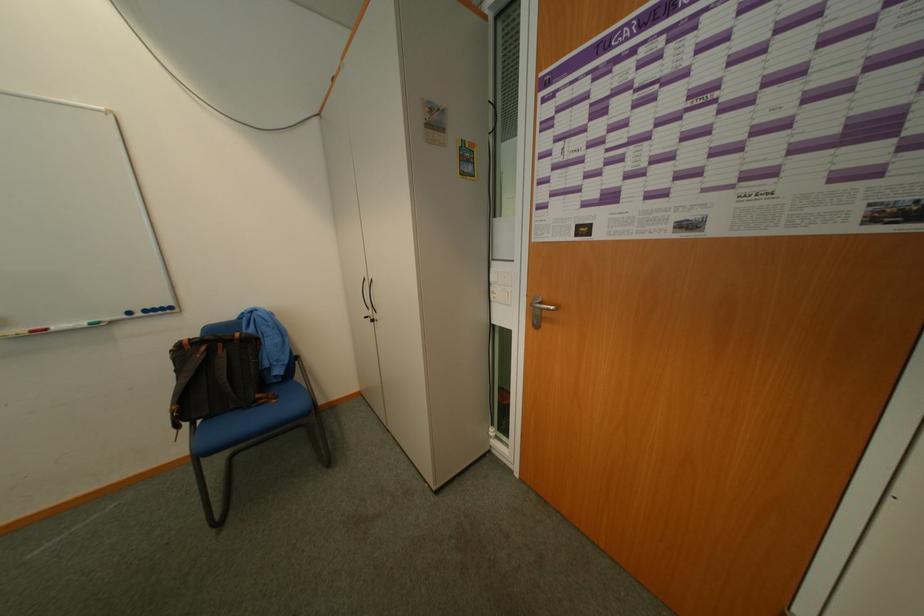
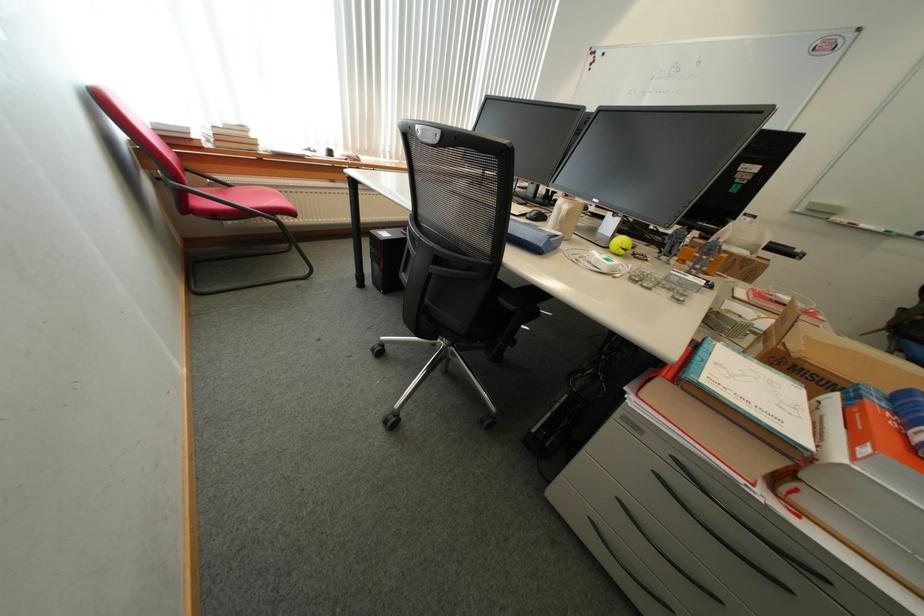
The point at (55, 331) is marked in the first image. Where is the corresponding point in the second image?

(861, 225)